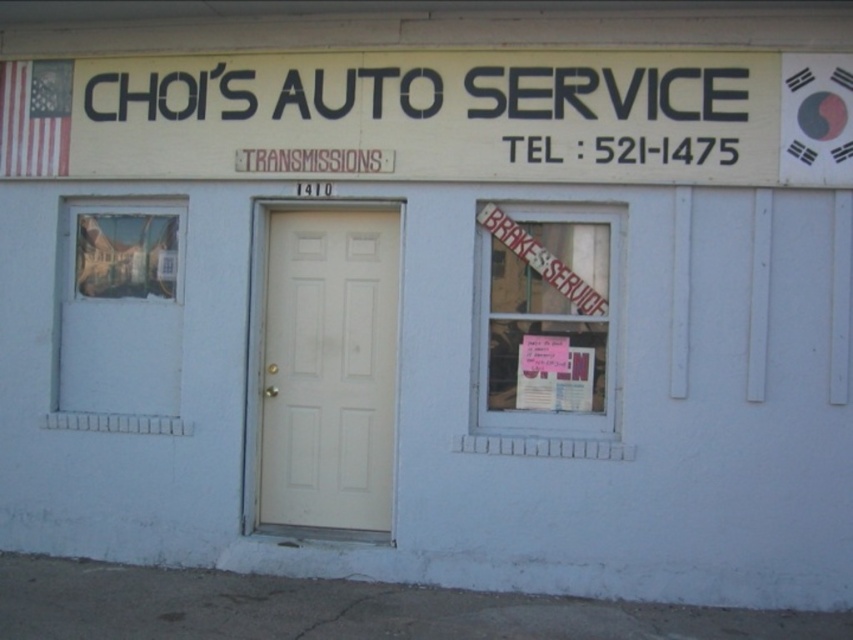
You are a customer standing in front of Choi Auto Service. You see the black plastic sign at upper center and the clear glass window at center right. Which object is closer to you?

The black plastic sign at upper center is closer to the viewer than the clear glass window at center right.